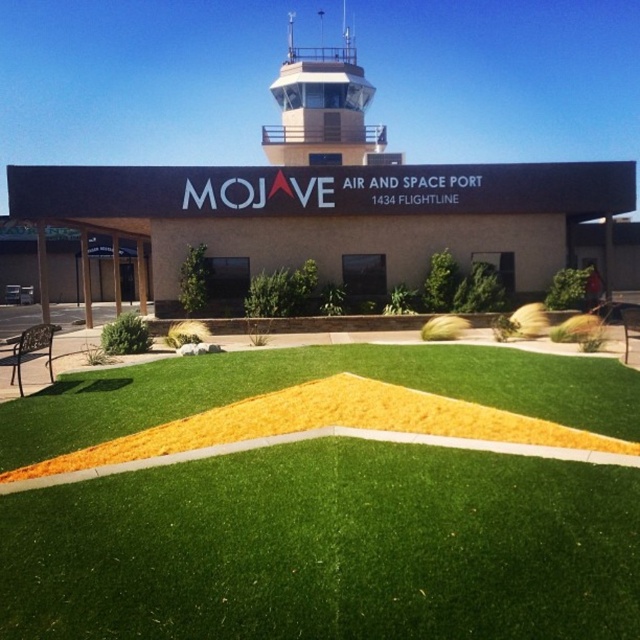
Does green artificial grass at center have a greater width compared to matte gray control tower at upper center?

No.

Does green artificial grass at center appear on the left side of matte gray control tower at upper center?

In fact, green artificial grass at center is to the right of matte gray control tower at upper center.

Between point (516, 372) and point (266, 154), which one is positioned behind?

The point (266, 154) is more distant.

Image resolution: width=640 pixels, height=640 pixels. I want to click on green artificial grass at center, so 326,548.